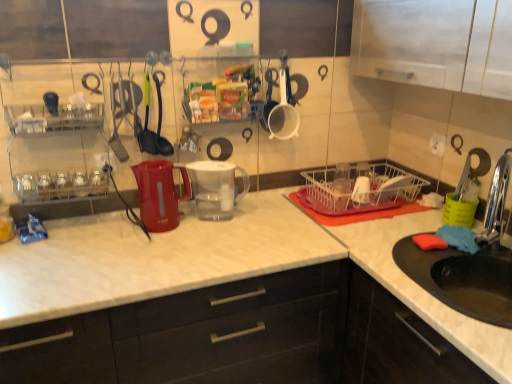
Identify the location of vacant area located to the right-hand side of matte plastic kettle at center, acting as the 1th appliance starting from the left. Image resolution: width=512 pixels, height=384 pixels. (207, 234).